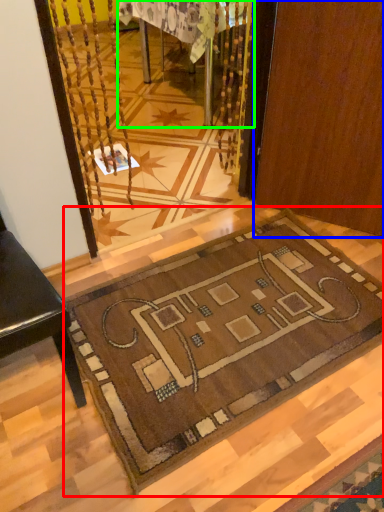
Question: Estimate the real-world distances between objects in this image. Which object is farther from mat (highlighted by a red box), door (highlighted by a blue box) or table (highlighted by a green box)?

Choices:
 (A) door
 (B) table

Answer: (B)